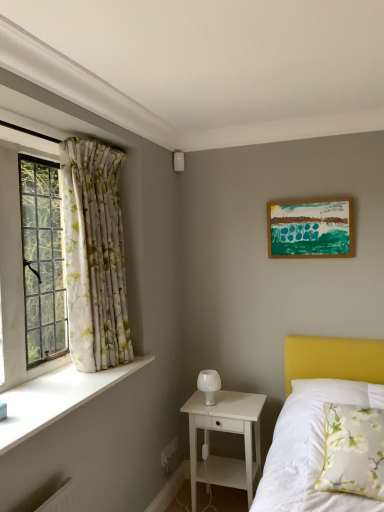
In order to click on vacant area located to the right-hand side of white frosted glass table lamp at center in this screenshot , I will do `click(243, 402)`.